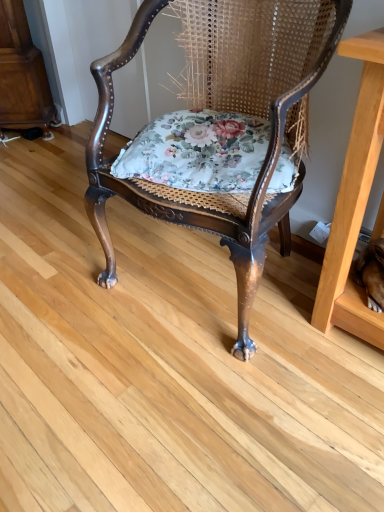
Question: Is floral fabric cushion at center surrounding polished wood chair at center?

Choices:
 (A) yes
 (B) no

Answer: (B)

Question: Is floral fabric cushion at center closer to the viewer compared to polished wood chair at center?

Choices:
 (A) yes
 (B) no

Answer: (B)

Question: Can you confirm if floral fabric cushion at center is positioned to the right of polished wood chair at center?

Choices:
 (A) yes
 (B) no

Answer: (B)

Question: Is floral fabric cushion at center wider than polished wood chair at center?

Choices:
 (A) yes
 (B) no

Answer: (B)

Question: From the image's perspective, is floral fabric cushion at center beneath polished wood chair at center?

Choices:
 (A) yes
 (B) no

Answer: (A)

Question: Is floral fabric cushion at center positioned beyond the bounds of polished wood chair at center?

Choices:
 (A) yes
 (B) no

Answer: (B)

Question: Does polished wood chair at center appear on the left side of floral fabric cushion at center?

Choices:
 (A) yes
 (B) no

Answer: (B)

Question: Would you consider polished wood chair at center to be distant from floral fabric cushion at center?

Choices:
 (A) no
 (B) yes

Answer: (A)

Question: Are polished wood chair at center and floral fabric cushion at center beside each other?

Choices:
 (A) yes
 (B) no

Answer: (B)

Question: From the image's perspective, is polished wood chair at center over floral fabric cushion at center?

Choices:
 (A) yes
 (B) no

Answer: (A)

Question: Is polished wood chair at center behind floral fabric cushion at center?

Choices:
 (A) yes
 (B) no

Answer: (B)

Question: Does polished wood chair at center have a lesser width compared to floral fabric cushion at center?

Choices:
 (A) yes
 (B) no

Answer: (B)

Question: Considering the positions of floral fabric cushion at center and polished wood chair at center in the image, is floral fabric cushion at center taller or shorter than polished wood chair at center?

Choices:
 (A) short
 (B) tall

Answer: (A)